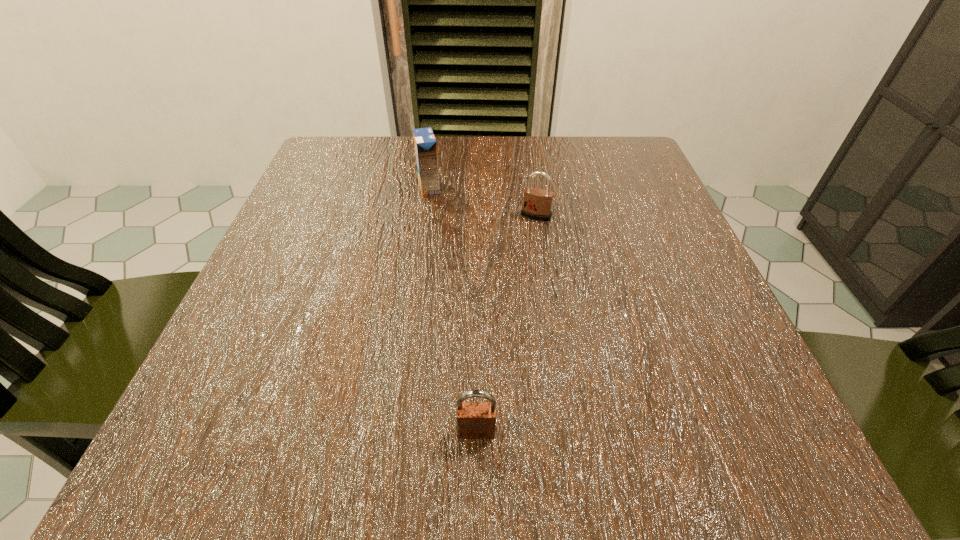
Identify which object is the second closest to the left padlock. Please provide its 2D coordinates. Your answer should be formatted as a tuple, i.e. [(x, y)], where the tuple contains the x and y coordinates of a point satisfying the conditions above.

[(425, 144)]

Where is `vacant region that satisfies the following two spatial constraints: 1. on the front side of the leftmost object; 2. on the left side of the right padlock`? vacant region that satisfies the following two spatial constraints: 1. on the front side of the leftmost object; 2. on the left side of the right padlock is located at coordinates (425, 215).